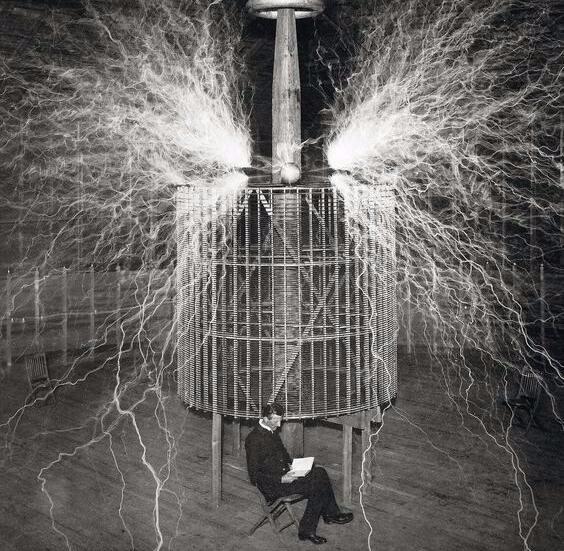
At what (x,y) coordinates should I click in order to perform the action: click on chair seat. Please return your answer as a coordinate pair (x, y). Image resolution: width=564 pixels, height=551 pixels. Looking at the image, I should click on (290, 501).